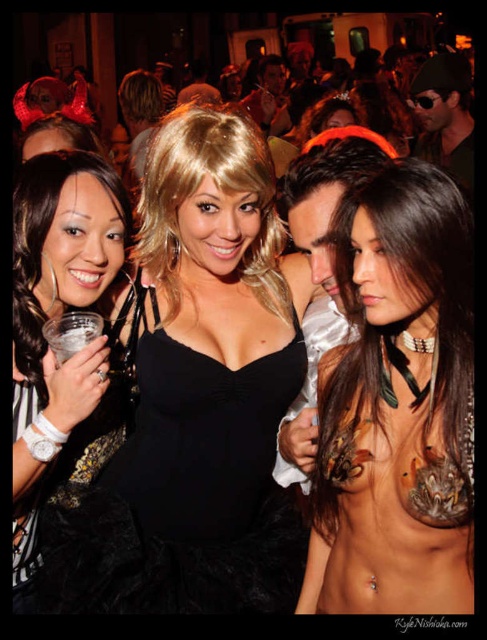
Question: Is black lace dress at left bigger than clear plastic cup at left?

Choices:
 (A) yes
 (B) no

Answer: (A)

Question: Which of these objects is positioned closest to the nude skin at center?

Choices:
 (A) black lace dress at left
 (B) black velvet dress at center
 (C) clear plastic cup at left

Answer: (B)

Question: Estimate the real-world distances between objects in this image. Which object is closer to the black lace dress at left?

Choices:
 (A) clear plastic cup at left
 (B) black velvet dress at center
 (C) nude skin at center

Answer: (A)

Question: Which of these objects is positioned farthest from the black velvet dress at center?

Choices:
 (A) nude skin at center
 (B) clear plastic cup at left
 (C) black lace dress at left

Answer: (B)

Question: Is black velvet dress at center in front of clear plastic cup at left?

Choices:
 (A) yes
 (B) no

Answer: (B)

Question: Does black lace dress at left have a larger size compared to clear plastic cup at left?

Choices:
 (A) yes
 (B) no

Answer: (A)